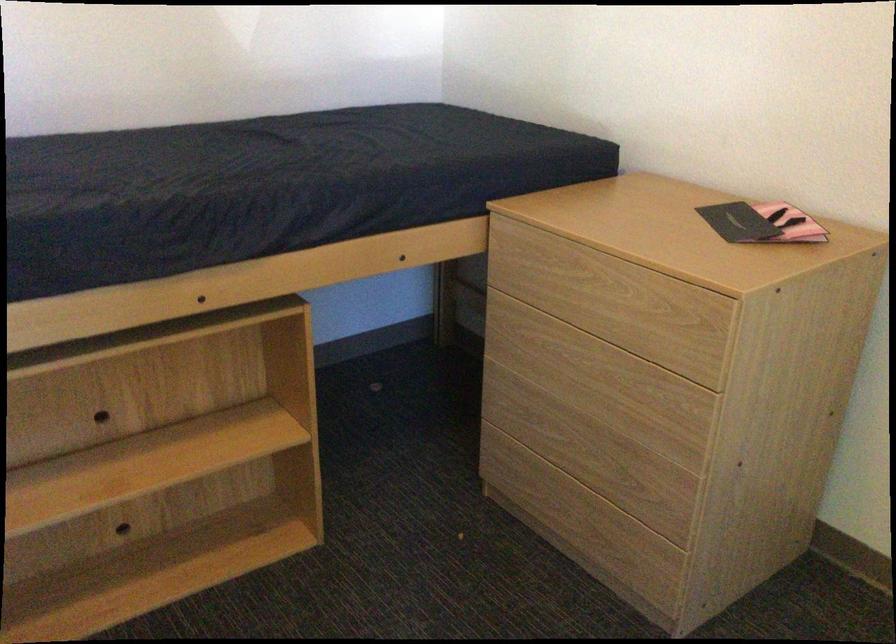
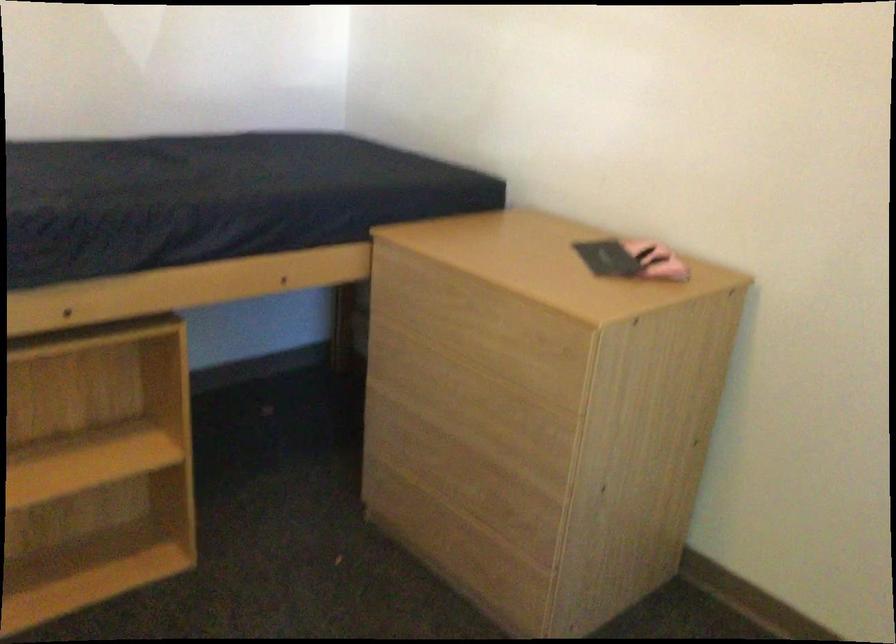
Question: The first image is from the beginning of the video and the second image is from the end. How did the camera likely rotate when shooting the video?

Choices:
 (A) Left
 (B) Right
 (C) Up
 (D) Down

Answer: (B)